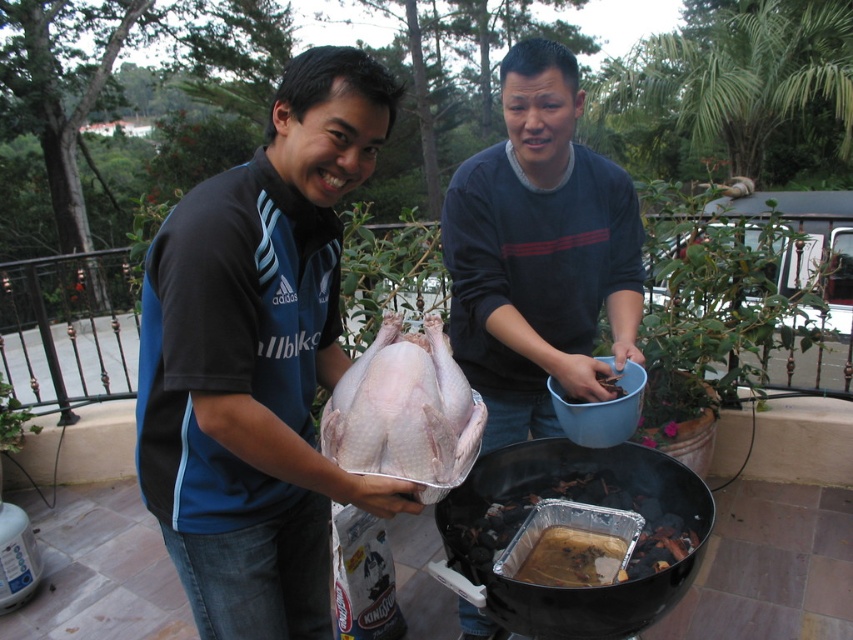
Question: Which of the following is the farthest from the observer?

Choices:
 (A) (467, 552)
 (B) (364, 419)
 (C) (309, 147)

Answer: (A)

Question: Can you confirm if dark blue sweater at center is bigger than pale pink raw turkey at center?

Choices:
 (A) no
 (B) yes

Answer: (B)

Question: Which object is farther from the camera taking this photo?

Choices:
 (A) brown aluminum foil pan at lower center
 (B) matte blue shirt at center
 (C) brown matte wood at center

Answer: (C)

Question: Is dark blue sweater at center closer to camera compared to brown matte wood at center?

Choices:
 (A) yes
 (B) no

Answer: (A)

Question: Which of the following is the closest to the observer?

Choices:
 (A) brown matte wood at center
 (B) pale pink raw turkey at center
 (C) brown aluminum foil pan at lower center

Answer: (B)

Question: Where is matte blue shirt at center located in relation to brown aluminum foil pan at lower center in the image?

Choices:
 (A) left
 (B) right

Answer: (A)